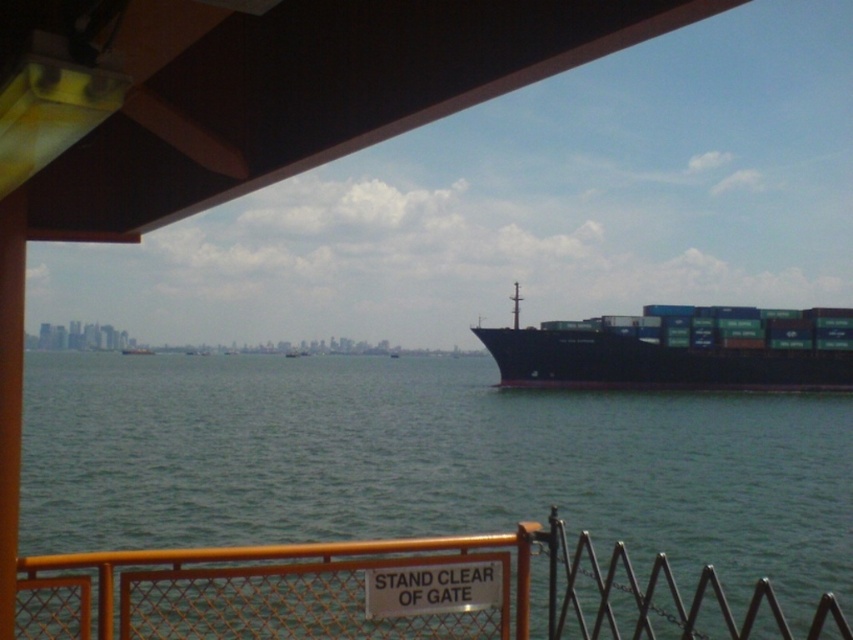
Question: Which object is the closest to the yellow metal fence at lower center?

Choices:
 (A) black matte container ship at right
 (B) green water at lower center
 (C) green matte container ship at center

Answer: (B)

Question: Which of the following is the closest to the observer?

Choices:
 (A) (189, 515)
 (B) (140, 348)
 (C) (567, 595)

Answer: (C)

Question: Can you confirm if green water at lower center is positioned to the left of green matte container ship at center?

Choices:
 (A) no
 (B) yes

Answer: (A)

Question: Does green water at lower center have a larger size compared to black matte container ship at right?

Choices:
 (A) no
 (B) yes

Answer: (B)

Question: Does yellow metal fence at lower center have a larger size compared to green matte container ship at center?

Choices:
 (A) no
 (B) yes

Answer: (A)

Question: Among these points, which one is farthest from the camera?

Choices:
 (A) (167, 579)
 (B) (653, 323)
 (C) (138, 346)
 (D) (689, 493)

Answer: (C)